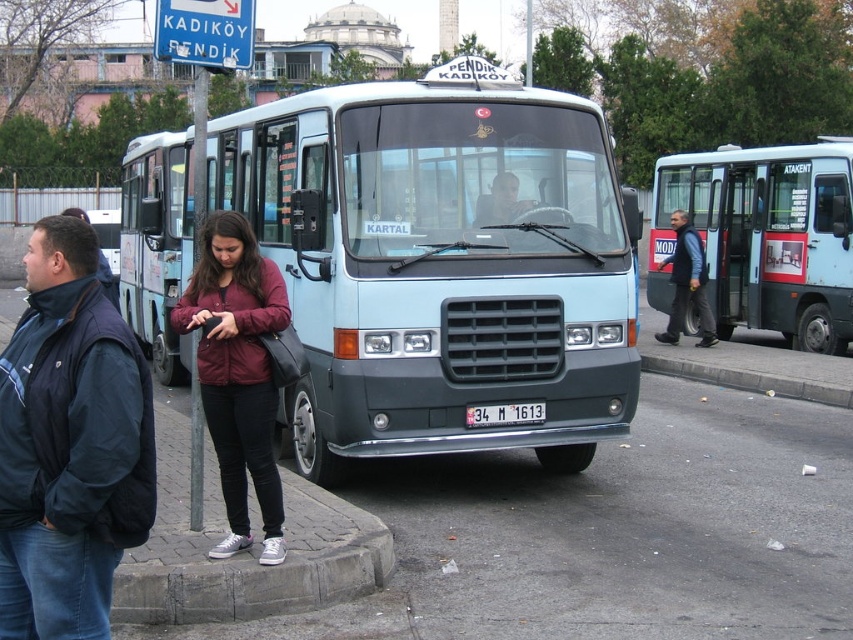
How much distance is there between light blue metallic bus at center and maroon fabric jacket at center?

They are 10.72 meters apart.

Can you confirm if light blue metallic bus at center is thinner than maroon fabric jacket at center?

Yes, light blue metallic bus at center is thinner than maroon fabric jacket at center.

Describe the element at coordinates (764, 237) in the screenshot. I see `light blue metallic bus at center` at that location.

Find the location of a particular element. The image size is (853, 640). light blue metallic bus at center is located at coordinates (764, 237).

Between maroon fabric jacket at center and matte black face at center, which one has more height?

maroon fabric jacket at center

Is maroon fabric jacket at center to the left of matte black face at center from the viewer's perspective?

Yes, maroon fabric jacket at center is to the left of matte black face at center.

Who is more distant from viewer, (276, 502) or (506, 218)?

Point (506, 218)

This screenshot has width=853, height=640. What are the coordinates of `maroon fabric jacket at center` in the screenshot? It's located at (236, 372).

Is light blue metallic bus at center closer to the viewer compared to gray concrete curb at lower right?

No, it is not.

This screenshot has width=853, height=640. I want to click on light blue metallic bus at center, so click(x=764, y=237).